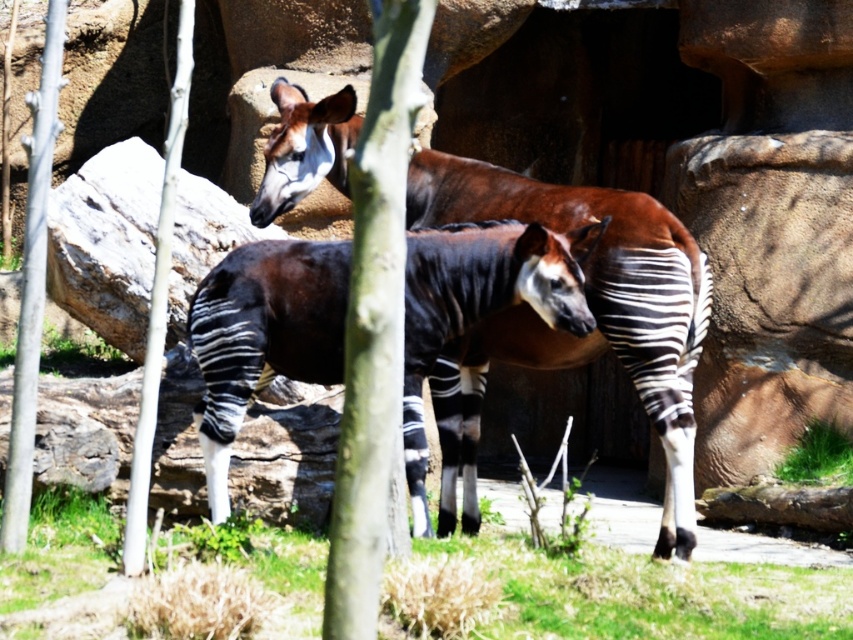
Can you confirm if zebra-striped okapi at center is wider than smooth bark tree at left?

Correct, the width of zebra-striped okapi at center exceeds that of smooth bark tree at left.

Measure the distance between zebra-striped okapi at center and smooth bark tree at left.

9.48 feet

Which is behind, point (645, 333) or point (178, 83)?

Point (645, 333)

Where is `zebra-striped okapi at center`? The height and width of the screenshot is (640, 853). zebra-striped okapi at center is located at coordinates (569, 336).

At what (x,y) coordinates should I click in order to perform the action: click on black and white striped okapi at center. Please return your answer as a coordinate pair (x, y). Looking at the image, I should click on (263, 336).

Is the position of black and white striped okapi at center more distant than that of green bark tree at center?

Yes.

Consider the image. Who is more forward, (442, 300) or (361, 536)?

Positioned in front is point (361, 536).

Locate an element on the screen. The height and width of the screenshot is (640, 853). black and white striped okapi at center is located at coordinates (263, 336).

Is point (248, 269) positioned in front of point (126, 513)?

No, it is behind (126, 513).

Is black and white striped okapi at center positioned before smooth bark tree at left?

No, it is not.

Is point (335, 380) behind point (173, 108)?

Yes, point (335, 380) is behind point (173, 108).

Where is `black and white striped okapi at center`? black and white striped okapi at center is located at coordinates (263, 336).